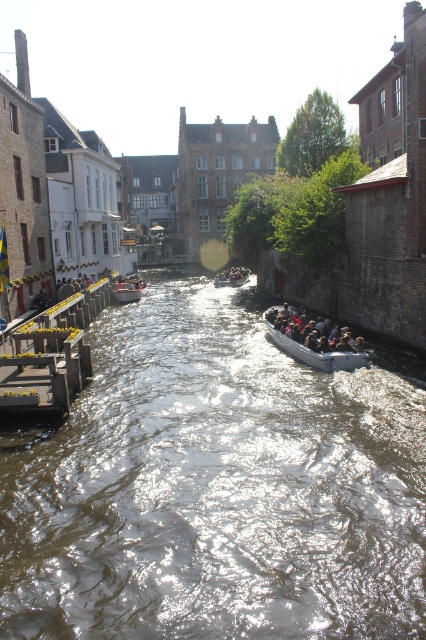
Does brown water at center appear over wooden boat at center?

No, brown water at center is not above wooden boat at center.

What do you see at coordinates (216, 484) in the screenshot? I see `brown water at center` at bounding box center [216, 484].

Image resolution: width=426 pixels, height=640 pixels. Identify the location of brown water at center. (216, 484).

Is wooden boat at center above metallic gray boat at center?

Incorrect, wooden boat at center is not positioned above metallic gray boat at center.

What do you see at coordinates (127, 289) in the screenshot? I see `wooden boat at center` at bounding box center [127, 289].

Locate an element on the screen. wooden boat at center is located at coordinates (127, 289).

What do you see at coordinates (216, 484) in the screenshot? This screenshot has height=640, width=426. I see `brown water at center` at bounding box center [216, 484].

Who is positioned more to the right, brown water at center or wooden dock at left?

brown water at center is more to the right.

The width and height of the screenshot is (426, 640). What do you see at coordinates (216, 484) in the screenshot? I see `brown water at center` at bounding box center [216, 484].

You are a GUI agent. You are given a task and a screenshot of the screen. Output one action in this format:
    pyautogui.click(x=<x>, y=<y>)
    Task: Click on the brown water at center
    The height and width of the screenshot is (640, 426).
    Given the screenshot: What is the action you would take?
    pyautogui.click(x=216, y=484)